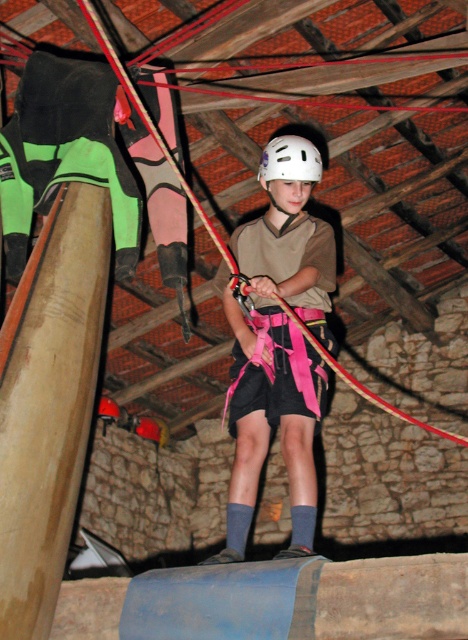
You are standing at the entrance of the ropes course area and want to reach the point marked at coordinates point (446, 166). Given that your walking speed is 1.5 meters per second, how many seconds will it take you to reach that point?

The distance between you and point (446, 166) is 7.32 meters. At a speed of 1.5 meters per second, it will take 7.32 divided by 1.5, which equals approximately 4.88 seconds. Therefore, it will take about 5 seconds to reach the point.

You are a participant in the ropes course and need to attach your safety harness to the nearest anchor point. There is a pink fabric rope at center and a red rope at lower right. Which object is closer to the point where you are standing at point (275, 77)?

The point (275, 77) is on pink fabric rope at center, so the pink fabric rope at center is closer to your current position.

You are a safety inspector checking the ropes course setup. You notice two pink items at the center of the course area. The pink fabric rope at center and the pink fabric harness at center. According to safety regulations, the distance between these two items must be at least 2 meters to prevent entanglement. Is the current setup compliant with the safety standards?

The pink fabric rope at center is 1.83 meters away from the pink fabric harness at center. Since 1.83 meters is less than the required 2 meters, the current setup does not comply with the safety standards and needs adjustment to increase the distance between them.